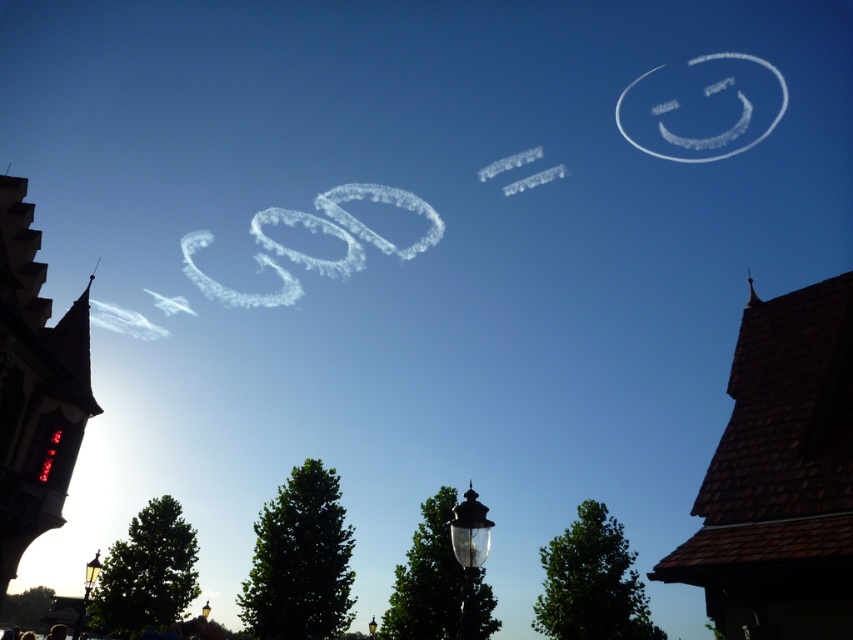
Does point (476, 627) lie in front of point (207, 604)?

Yes.

Between point (473, 618) and point (201, 609), which one is positioned in front?

Point (473, 618) is in front.

Measure the distance between transparent glass lamp post at center and camera.

transparent glass lamp post at center is 6.87 meters away from camera.

Identify the location of transparent glass lamp post at center. (469, 554).

Between matte black lamp post at lower left and matte black lamp post at center, which one appears on the left side from the viewer's perspective?

From the viewer's perspective, matte black lamp post at center appears more on the left side.

Which of these two, matte black lamp post at lower left or matte black lamp post at center, stands taller?

matte black lamp post at center

Find the location of a particular element. This screenshot has height=640, width=853. matte black lamp post at lower left is located at coordinates (86, 589).

The height and width of the screenshot is (640, 853). Identify the location of matte black lamp post at lower left. (86, 589).

Is transparent glass lamp post at center positioned in front of matte black lamp post at lower left?

Yes, it is in front of matte black lamp post at lower left.

In the scene shown: Is transparent glass lamp post at center to the left of matte black lamp post at lower left from the viewer's perspective?

No, transparent glass lamp post at center is not to the left of matte black lamp post at lower left.

What are the coordinates of `transparent glass lamp post at center` in the screenshot? It's located at (469, 554).